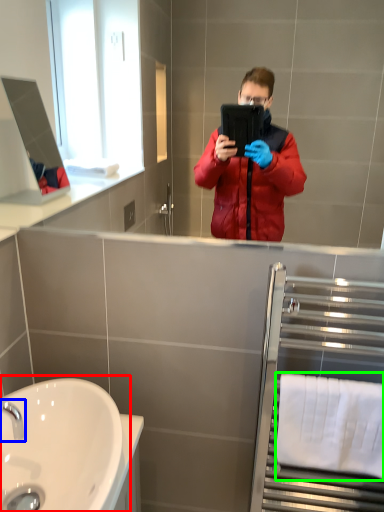
Question: Which object is the farthest from sink (highlighted by a red box)? Choose among these: tap (highlighted by a blue box) or towel bar (highlighted by a green box).

Choices:
 (A) tap
 (B) towel bar

Answer: (B)